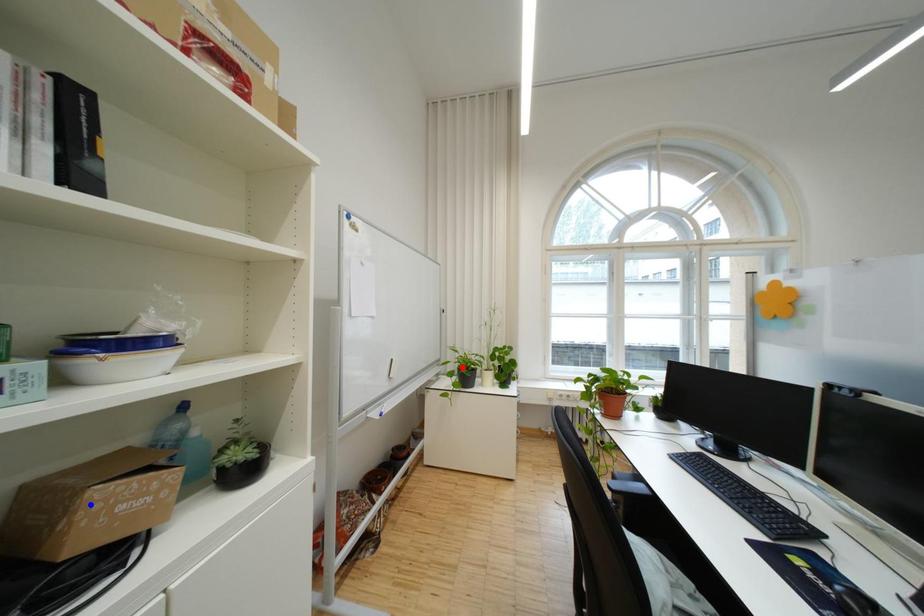
Question: Which of the two points in the image is closer to the camera?

Choices:
 (A) Blue point is closer.
 (B) Red point is closer.

Answer: (A)